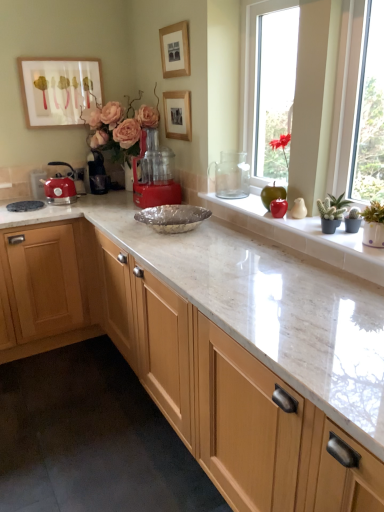
Question: Can you confirm if red plastic food processor at center, which is the first coffee machine in front-to-back order, is taller than wooden picture frame at upper center, acting as the 2th picture frame starting from the right?

Choices:
 (A) yes
 (B) no

Answer: (A)

Question: Can you confirm if red plastic food processor at center, arranged as the second coffee machine when viewed from the left, is thinner than wooden picture frame at upper center, acting as the 2th picture frame starting from the right?

Choices:
 (A) yes
 (B) no

Answer: (B)

Question: Considering the relative sizes of red plastic food processor at center, arranged as the second coffee machine when viewed from the left, and wooden picture frame at upper center, acting as the 2th picture frame starting from the right, in the image provided, is red plastic food processor at center, arranged as the second coffee machine when viewed from the left, bigger than wooden picture frame at upper center, acting as the 2th picture frame starting from the right,?

Choices:
 (A) yes
 (B) no

Answer: (A)

Question: From a real-world perspective, is red plastic food processor at center, which is the second coffee machine from back to front, on top of wooden picture frame at upper center, acting as the 2th picture frame starting from the right?

Choices:
 (A) no
 (B) yes

Answer: (A)

Question: Is red plastic food processor at center, arranged as the second coffee machine when viewed from the left, aimed at wooden picture frame at upper center, acting as the second picture frame starting from the left?

Choices:
 (A) yes
 (B) no

Answer: (B)

Question: Is red plastic food processor at center, which is the first coffee machine in front-to-back order, positioned beyond the bounds of wooden picture frame at upper center, acting as the second picture frame starting from the left?

Choices:
 (A) yes
 (B) no

Answer: (A)

Question: Considering the relative sizes of green matte apple at upper right and black plastic coffee machine at center, the 2th coffee machine when ordered from right to left, in the image provided, is green matte apple at upper right bigger than black plastic coffee machine at center, the 2th coffee machine when ordered from right to left,?

Choices:
 (A) no
 (B) yes

Answer: (B)

Question: Is the depth of green matte apple at upper right less than that of black plastic coffee machine at center, the first coffee machine from the left?

Choices:
 (A) no
 (B) yes

Answer: (B)

Question: Considering the relative sizes of green matte apple at upper right and black plastic coffee machine at center, the second coffee machine when ordered from front to back, in the image provided, is green matte apple at upper right thinner than black plastic coffee machine at center, the second coffee machine when ordered from front to back,?

Choices:
 (A) yes
 (B) no

Answer: (B)

Question: From a real-world perspective, is green matte apple at upper right over black plastic coffee machine at center, the first coffee machine from the left?

Choices:
 (A) no
 (B) yes

Answer: (A)

Question: Is green matte apple at upper right facing away from black plastic coffee machine at center, the first coffee machine from the left?

Choices:
 (A) no
 (B) yes

Answer: (A)

Question: Is green matte apple at upper right wider than black plastic coffee machine at center, arranged as the 1th coffee machine when viewed from the back?

Choices:
 (A) no
 (B) yes

Answer: (B)

Question: Considering the relative sizes of green succulent at right, the second plant in the top-to-bottom sequence, and matte red kettle at left in the image provided, is green succulent at right, the second plant in the top-to-bottom sequence, taller than matte red kettle at left?

Choices:
 (A) yes
 (B) no

Answer: (B)